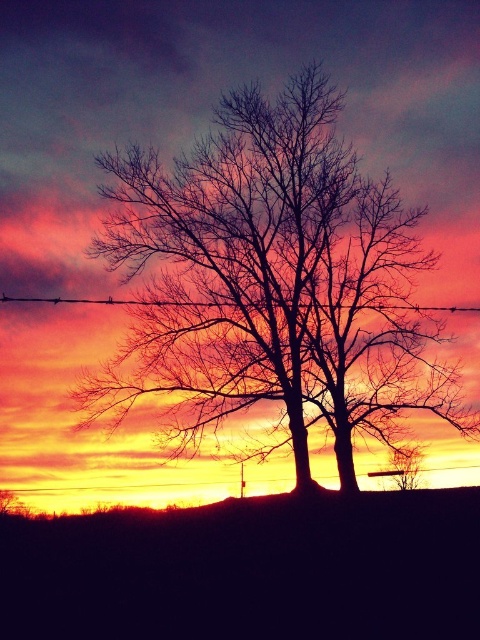
Question: Which point appears farthest from the camera in this image?

Choices:
 (A) (245, 150)
 (B) (400, 456)
 (C) (159, 305)

Answer: (B)

Question: Among these objects, which one is farthest from the camera?

Choices:
 (A) barbed wire at center
 (B) bare wood tree at lower right
 (C) bare branches at center

Answer: (B)

Question: Considering the real-world distances, which object is closest to the bare wood tree at lower right?

Choices:
 (A) bare branches at center
 (B) barbed wire at center

Answer: (A)

Question: Does bare branches at center have a greater width compared to bare wood tree at lower right?

Choices:
 (A) yes
 (B) no

Answer: (A)

Question: Does bare branches at center have a lesser width compared to barbed wire at center?

Choices:
 (A) no
 (B) yes

Answer: (B)

Question: Is bare branches at center to the left of bare wood tree at lower right from the viewer's perspective?

Choices:
 (A) yes
 (B) no

Answer: (A)